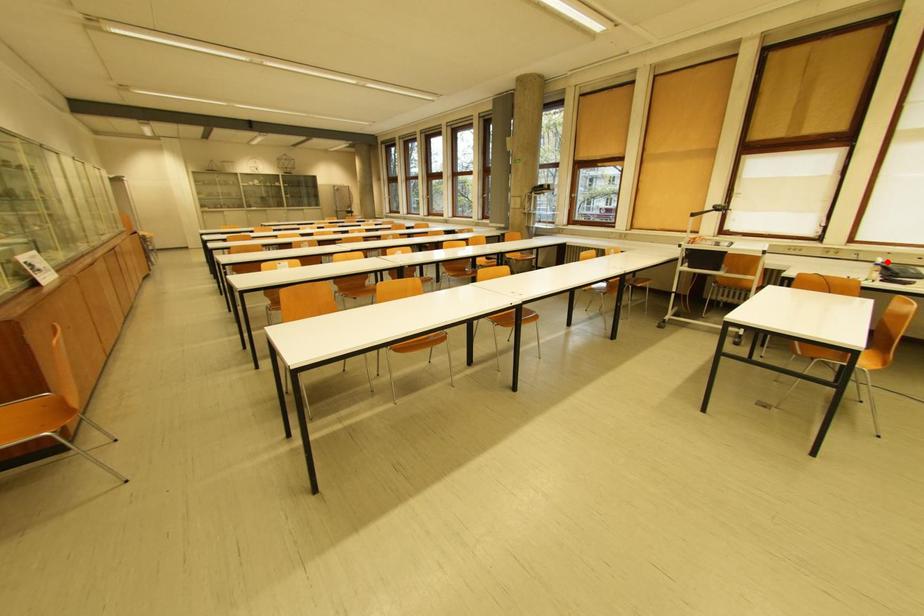
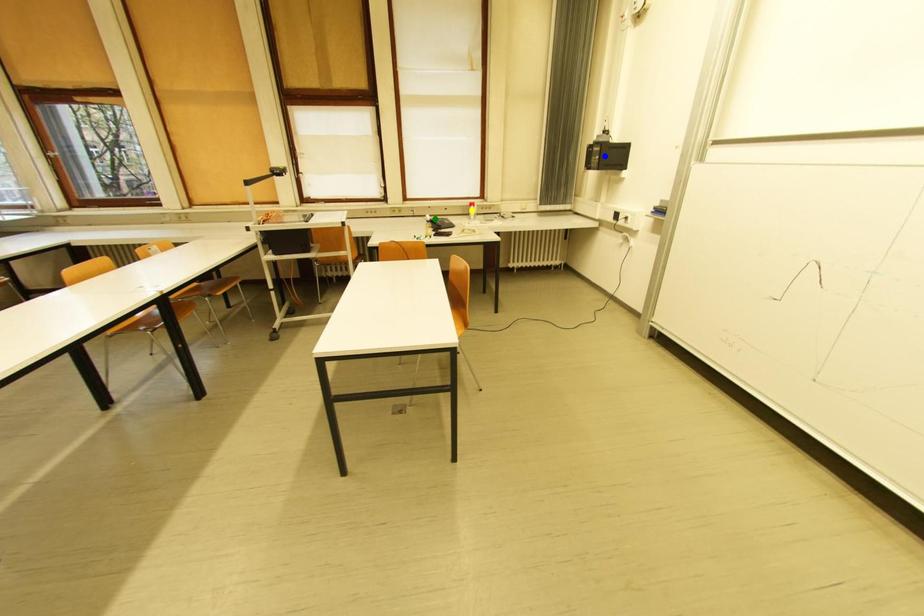
Question: I am providing you with two images of the same scene from different viewpoints. A red point is marked on the first image. You are given multiple points on the second image. Which spot in image 2 lines up with the point in image 1?

Choices:
 (A) green point
 (B) blue point
 (C) yellow point

Answer: (A)